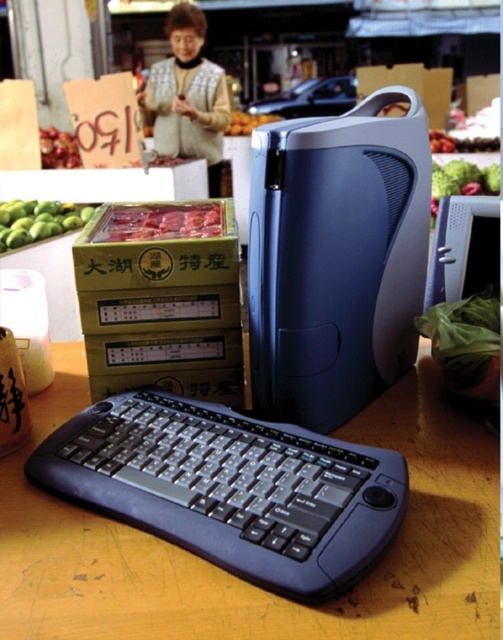
You are a customer at the market and want to place your green plastic bag at lower right onto the satin blue desktop at center. Can you move it directly in front of the desktop?

The satin blue desktop at center is to the left of green plastic bag at lower right, so you can move the green plastic bag at lower right to the left to place it directly in front of the satin blue desktop at center.

You are a customer at the market and want to buy both the plaid woolen vest at upper center and the green matte apples at left. Which item takes up more space on the table?

The plaid woolen vest at upper center is bigger than the green matte apples at left, so it takes up more space on the table.

You are a customer at the market and see both the plaid woolen vest at upper center and the green matte apples at left. Which item is located to the right of the other?

The plaid woolen vest at upper center is positioned on the right side of green matte apples at left, so the plaid woolen vest at upper center is to the right of the green matte apples at left.